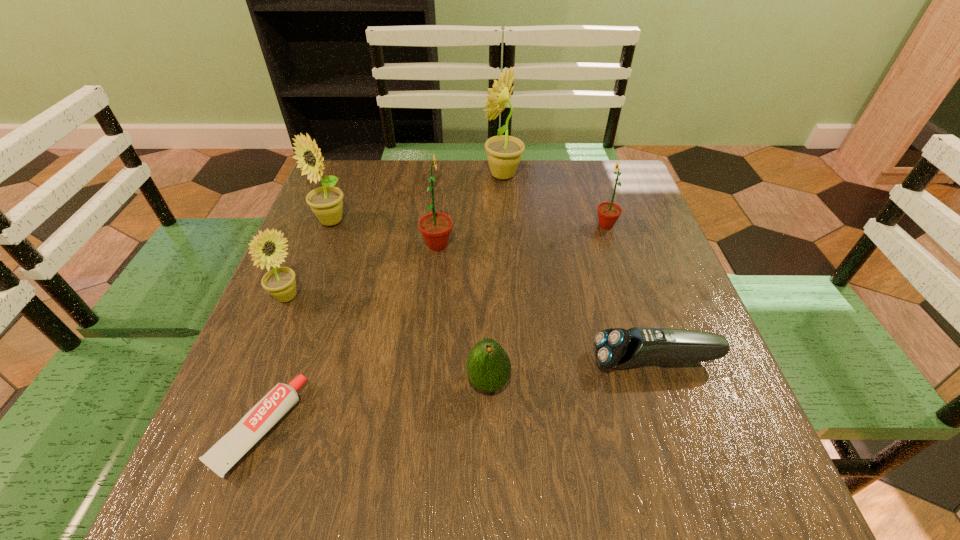
What are the coordinates of `the tallest sunflower` in the screenshot? It's located at (504, 152).

Identify the location of the second sunflower from right to left. (504, 152).

Find the location of a particular element. The width and height of the screenshot is (960, 540). the third sunflower from right to left is located at coordinates (435, 227).

The image size is (960, 540). I want to click on the fourth farthest sunflower, so [x=435, y=227].

Find the location of `the second smallest yellow sunflower`. the second smallest yellow sunflower is located at coordinates (326, 202).

Find the location of a particular element. the nearest sunflower is located at coordinates (280, 282).

You are a GUI agent. You are given a task and a screenshot of the screen. Output one action in this format:
    pyautogui.click(x=<x>, y=<y>)
    Task: Click on the nearest yellow sunflower
    The height and width of the screenshot is (540, 960).
    Given the screenshot: What is the action you would take?
    pyautogui.click(x=280, y=282)

The height and width of the screenshot is (540, 960). In order to click on the right green sunflower in this screenshot , I will do `click(608, 212)`.

You are a GUI agent. You are given a task and a screenshot of the screen. Output one action in this format:
    pyautogui.click(x=<x>, y=<y>)
    Task: Click on the rightmost sunflower
    
    Given the screenshot: What is the action you would take?
    pyautogui.click(x=608, y=212)

Locate an element on the screen. This screenshot has width=960, height=540. avocado is located at coordinates (488, 366).